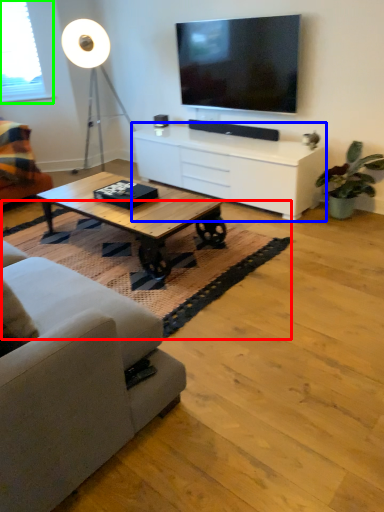
Question: Which object is the farthest from mat (highlighted by a red box)? Choose among these: cabinetry (highlighted by a blue box) or window screen (highlighted by a green box).

Choices:
 (A) cabinetry
 (B) window screen

Answer: (B)